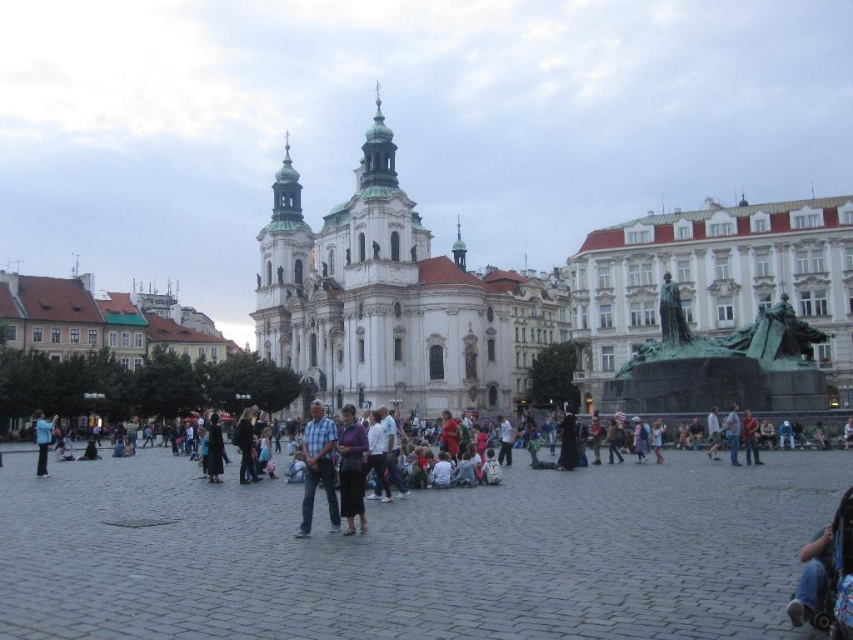
Between gray cobblestone square at center and purple matte dress at center, which one appears on the left side from the viewer's perspective?

purple matte dress at center is more to the left.

Locate an element on the screen. Image resolution: width=853 pixels, height=640 pixels. gray cobblestone square at center is located at coordinates (412, 554).

Consider the image. Is bronze statue at center-right bigger than purple matte dress at center?

Incorrect, bronze statue at center-right is not larger than purple matte dress at center.

Who is more forward, (618, 378) or (352, 435)?

Point (352, 435) is more forward.

Locate an element on the screen. The height and width of the screenshot is (640, 853). bronze statue at center-right is located at coordinates pos(721,364).

Between bronze statue at center-right and blue plaid shirt at center, which one is positioned higher?

bronze statue at center-right is higher up.

Does bronze statue at center-right have a lesser width compared to blue plaid shirt at center?

No.

Which is behind, point (689, 381) or point (326, 435)?

The point (689, 381) is more distant.

This screenshot has width=853, height=640. What are the coordinates of `bronze statue at center-right` in the screenshot? It's located at (721, 364).